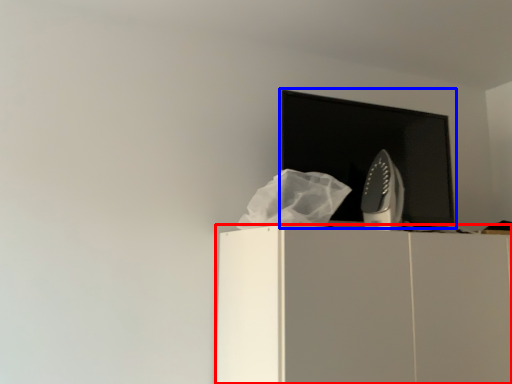
Question: Which object is closer to the camera taking this photo, furniture (highlighted by a red box) or computer monitor (highlighted by a blue box)?

Choices:
 (A) furniture
 (B) computer monitor

Answer: (A)